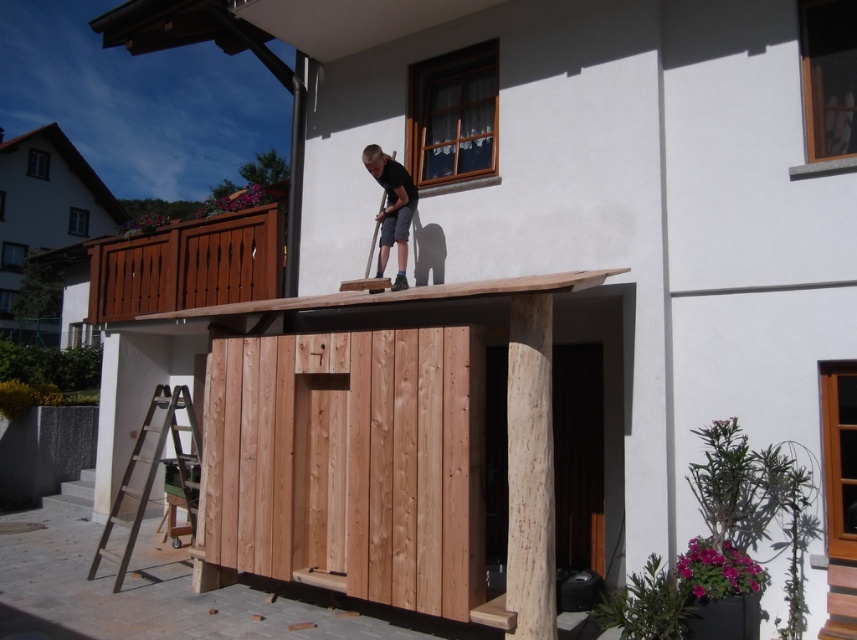
You are a delivery person trying to reach the front door of the brown wooden hut at left. You see the brown wooden ladder at lower left. Is the ladder blocking your path to the front door?

The brown wooden ladder at lower left is behind brown wooden hut at left, so it is not blocking the path to the front door.

You are a construction worker standing at point (x=112, y=516) and need to move to point (x=109, y=312). Is the point you want to reach in front of or behind your current position?

Point (x=109, y=312) is behind point (x=112, y=516), so the desired point is behind your current position.